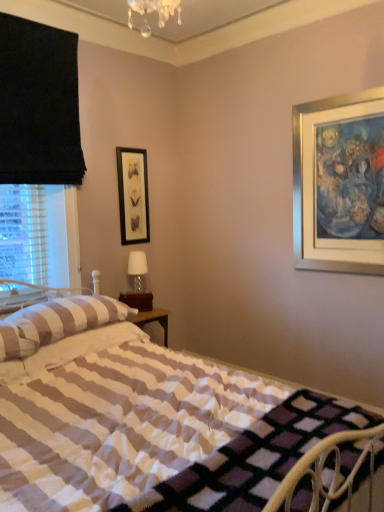
Question: Is striped fabric pillow at left taller than black matte picture frame at upper center?

Choices:
 (A) yes
 (B) no

Answer: (B)

Question: Is striped fabric pillow at left closer to the viewer compared to black matte picture frame at upper center?

Choices:
 (A) yes
 (B) no

Answer: (A)

Question: Is striped fabric pillow at left turned away from black matte picture frame at upper center?

Choices:
 (A) yes
 (B) no

Answer: (B)

Question: Can you confirm if striped fabric pillow at left is bigger than black matte picture frame at upper center?

Choices:
 (A) no
 (B) yes

Answer: (B)

Question: From a real-world perspective, is striped fabric pillow at left on top of black matte picture frame at upper center?

Choices:
 (A) yes
 (B) no

Answer: (B)

Question: Considering the positions of white matte table lamp at center and striped fabric pillow at left in the image, is white matte table lamp at center wider or thinner than striped fabric pillow at left?

Choices:
 (A) wide
 (B) thin

Answer: (B)

Question: From the image's perspective, is white matte table lamp at center above or below striped fabric pillow at left?

Choices:
 (A) above
 (B) below

Answer: (A)

Question: From a real-world perspective, is white matte table lamp at center above or below striped fabric pillow at left?

Choices:
 (A) below
 (B) above

Answer: (B)

Question: Is white matte table lamp at center in front of or behind striped fabric pillow at left in the image?

Choices:
 (A) front
 (B) behind

Answer: (B)

Question: In terms of height, does striped fabric pillow at left look taller or shorter compared to white matte table lamp at center?

Choices:
 (A) short
 (B) tall

Answer: (A)

Question: Visually, is striped fabric pillow at left positioned to the left or to the right of white matte table lamp at center?

Choices:
 (A) right
 (B) left

Answer: (B)

Question: From a real-world perspective, relative to white matte table lamp at center, is striped fabric pillow at left vertically above or below?

Choices:
 (A) above
 (B) below

Answer: (B)

Question: Considering the positions of striped fabric pillow at left and white matte table lamp at center in the image, is striped fabric pillow at left wider or thinner than white matte table lamp at center?

Choices:
 (A) thin
 (B) wide

Answer: (B)

Question: Relative to black matte picture frame at upper center, is striped fabric pillow at left in front or behind?

Choices:
 (A) behind
 (B) front

Answer: (B)

Question: Would you say striped fabric pillow at left is to the left or to the right of black matte picture frame at upper center in the picture?

Choices:
 (A) left
 (B) right

Answer: (A)